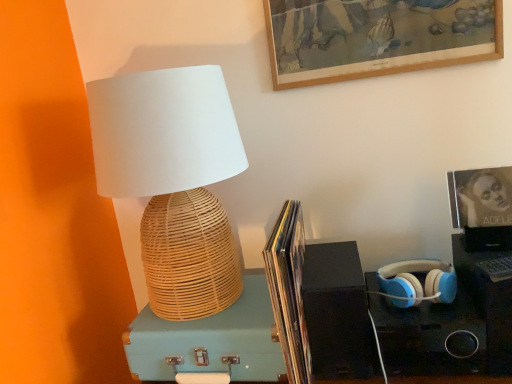
Question: Is blue matte headphones at right inside woven bamboo lamp at left?

Choices:
 (A) no
 (B) yes

Answer: (A)

Question: Considering the relative sizes of woven bamboo lamp at left and blue matte headphones at right in the image provided, is woven bamboo lamp at left bigger than blue matte headphones at right?

Choices:
 (A) yes
 (B) no

Answer: (A)

Question: From a real-world perspective, is woven bamboo lamp at left over blue matte headphones at right?

Choices:
 (A) no
 (B) yes

Answer: (B)

Question: From the image's perspective, is woven bamboo lamp at left on blue matte headphones at right?

Choices:
 (A) yes
 (B) no

Answer: (A)

Question: From a real-world perspective, is woven bamboo lamp at left physically below blue matte headphones at right?

Choices:
 (A) yes
 (B) no

Answer: (B)

Question: Can you confirm if woven bamboo lamp at left is positioned to the left of blue matte headphones at right?

Choices:
 (A) no
 (B) yes

Answer: (B)

Question: Is blue matte headphones at right outside of black matte speaker at lower right?

Choices:
 (A) yes
 (B) no

Answer: (A)

Question: Is blue matte headphones at right beside black matte speaker at lower right?

Choices:
 (A) yes
 (B) no

Answer: (B)

Question: From a real-world perspective, is blue matte headphones at right physically below black matte speaker at lower right?

Choices:
 (A) yes
 (B) no

Answer: (B)

Question: From the image's perspective, is blue matte headphones at right located above black matte speaker at lower right?

Choices:
 (A) yes
 (B) no

Answer: (A)

Question: Does blue matte headphones at right come in front of black matte speaker at lower right?

Choices:
 (A) no
 (B) yes

Answer: (A)

Question: Can you confirm if blue matte headphones at right is smaller than black matte speaker at lower right?

Choices:
 (A) yes
 (B) no

Answer: (A)

Question: Considering the relative sizes of light blue wicker suitcase at center and matte paper book at center in the image provided, is light blue wicker suitcase at center thinner than matte paper book at center?

Choices:
 (A) yes
 (B) no

Answer: (A)